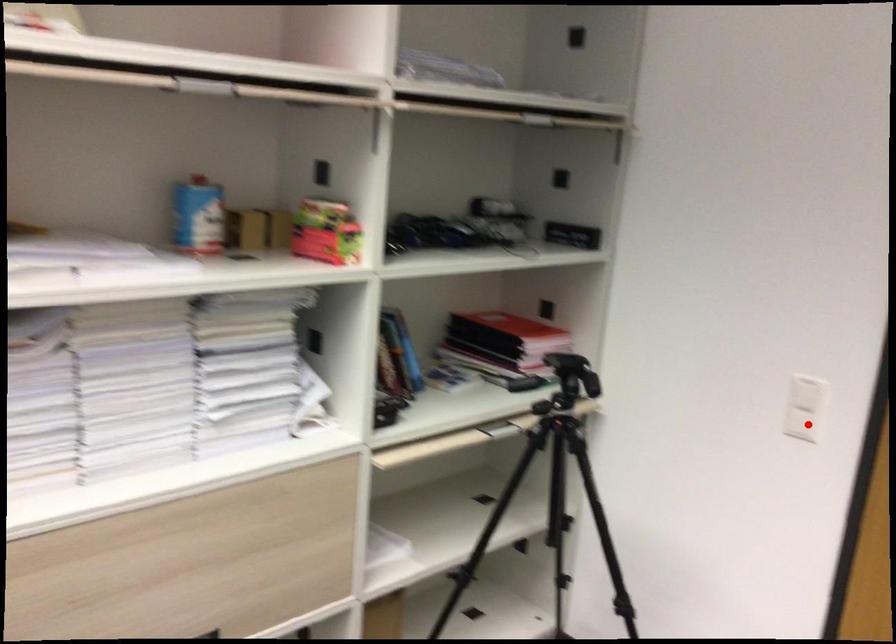
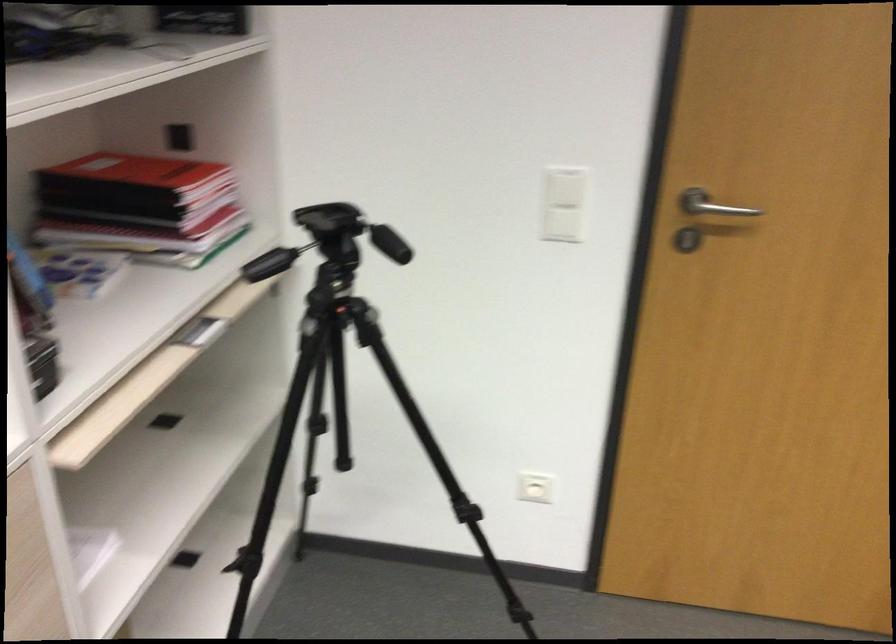
Find the pixel in the second image that matches the highlighted location in the first image.

(563, 225)